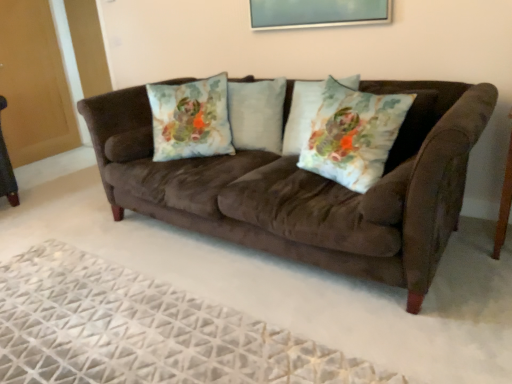
Image resolution: width=512 pixels, height=384 pixels. I want to click on vacant space underneath brown wood side table at right (from a real-world perspective), so click(501, 254).